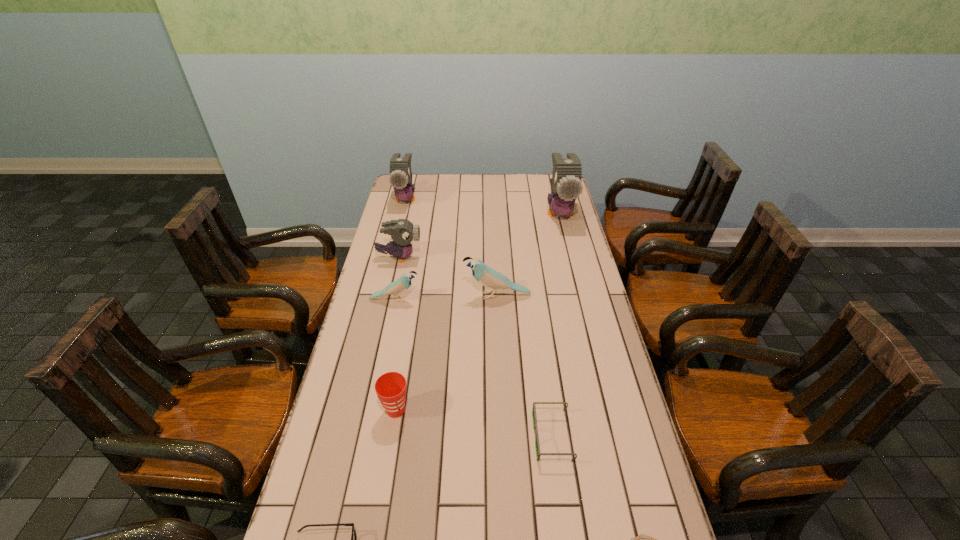
What are the coordinates of `free location located on the right of the cup` in the screenshot? It's located at (478, 410).

Image resolution: width=960 pixels, height=540 pixels. Identify the location of vacant space located on the lens of the black spectacles. (415, 437).

I want to click on vacant space situated on the lens of the black spectacles, so click(474, 437).

Find the location of `vacant space situated 0.390m on the lens of the black spectacles`. vacant space situated 0.390m on the lens of the black spectacles is located at coordinates (388, 437).

Identify the location of cup that is at the left edge. coord(390,387).

This screenshot has height=540, width=960. I want to click on object at the right edge, so click(x=566, y=185).

The width and height of the screenshot is (960, 540). In order to click on object located at the far left corner in this screenshot , I will do `click(400, 178)`.

What are the coordinates of `object at the far right corner` in the screenshot? It's located at (566, 185).

Locate an element on the screen. The image size is (960, 540). vacant space at the far edge of the desktop is located at coordinates (477, 180).

In the image, there is a desktop. Identify the location of vacant space at the left edge. Image resolution: width=960 pixels, height=540 pixels. (344, 368).